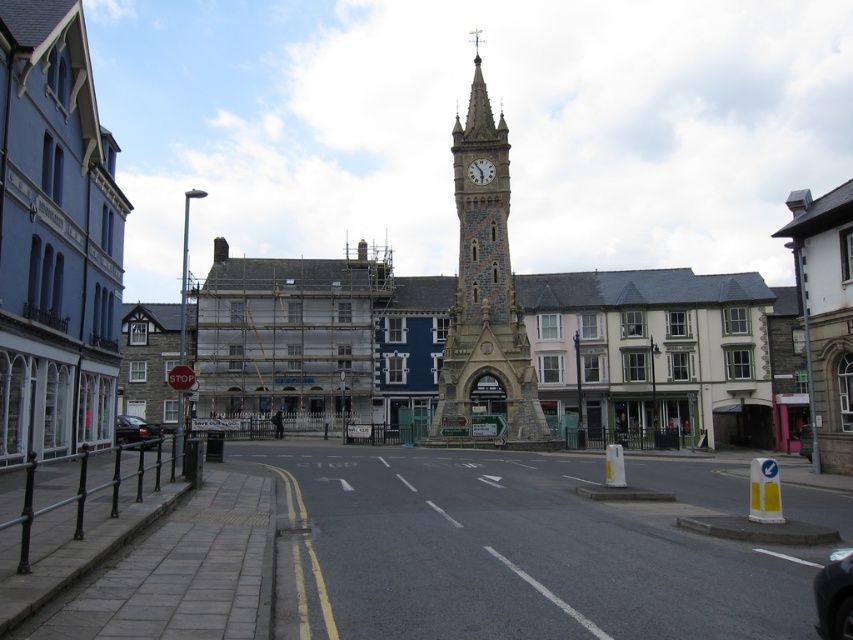
Is stone clock tower at center below shiny black car at lower right?

Incorrect, stone clock tower at center is not positioned below shiny black car at lower right.

Where is `stone clock tower at center`? stone clock tower at center is located at coordinates (485, 296).

Locate an element on the screen. This screenshot has width=853, height=640. stone clock tower at center is located at coordinates (485, 296).

Does shiny black car at lower right have a lesser height compared to white stone clock at center?

No.

How much distance is there between shiny black car at lower right and white stone clock at center?

76.57 meters

Does point (842, 552) come closer to viewer compared to point (490, 168)?

Yes, it is.

Locate an element on the screen. shiny black car at lower right is located at coordinates (834, 596).

Does shiny black car at lower left have a lesser width compared to white stone clock at center?

No, shiny black car at lower left is not thinner than white stone clock at center.

Is point (155, 436) positioned behind point (474, 180)?

No.

You are a GUI agent. You are given a task and a screenshot of the screen. Output one action in this format:
    pyautogui.click(x=<x>, y=<y>)
    Task: Click on the shiny black car at lower left
    Image resolution: width=853 pixels, height=640 pixels.
    Given the screenshot: What is the action you would take?
    pyautogui.click(x=135, y=429)